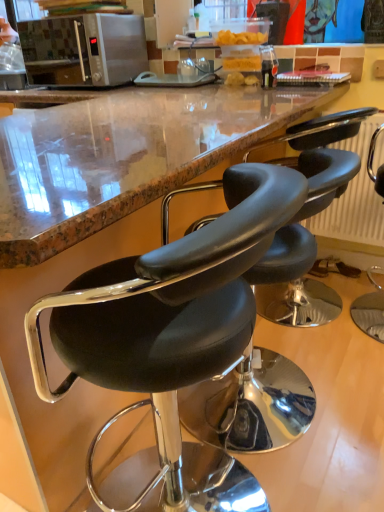
Question: Would you consider black leather chair at right, which appears as the first chair when viewed from the right, to be distant from black leather stool at center, arranged as the third chair when viewed from the right?

Choices:
 (A) no
 (B) yes

Answer: (B)

Question: Considering the relative sizes of black leather chair at right, the 3th chair in the left-to-right sequence, and black leather stool at center, positioned as the first chair in left-to-right order, in the image provided, is black leather chair at right, the 3th chair in the left-to-right sequence, smaller than black leather stool at center, positioned as the first chair in left-to-right order,?

Choices:
 (A) yes
 (B) no

Answer: (A)

Question: Can you confirm if black leather chair at right, which appears as the first chair when viewed from the right, is thinner than black leather stool at center, positioned as the first chair in left-to-right order?

Choices:
 (A) no
 (B) yes

Answer: (B)

Question: Considering the relative sizes of black leather chair at right, the 3th chair in the left-to-right sequence, and black leather stool at center, arranged as the third chair when viewed from the right, in the image provided, is black leather chair at right, the 3th chair in the left-to-right sequence, shorter than black leather stool at center, arranged as the third chair when viewed from the right,?

Choices:
 (A) yes
 (B) no

Answer: (A)

Question: From a real-world perspective, does black leather chair at right, the 3th chair in the left-to-right sequence, stand above black leather stool at center, arranged as the third chair when viewed from the right?

Choices:
 (A) no
 (B) yes

Answer: (A)

Question: Based on their positions, is black leather chair at right, which appears as the first chair when viewed from the right, located to the left or right of black leather stool at center, the 2th chair from the left?

Choices:
 (A) right
 (B) left

Answer: (A)

Question: Looking at the image, does black leather chair at right, the 3th chair in the left-to-right sequence, seem bigger or smaller compared to black leather stool at center, the 2th chair from the left?

Choices:
 (A) big
 (B) small

Answer: (B)

Question: From a real-world perspective, is black leather chair at right, which appears as the first chair when viewed from the right, physically located above or below black leather stool at center, the 2th chair from the left?

Choices:
 (A) above
 (B) below

Answer: (A)

Question: From the image's perspective, is black leather chair at right, which appears as the first chair when viewed from the right, above or below black leather stool at center, the 2th chair from the right?

Choices:
 (A) above
 (B) below

Answer: (A)

Question: Relative to black leather stool at center, arranged as the third chair when viewed from the right, is satin silver microwave at upper left in front or behind?

Choices:
 (A) front
 (B) behind

Answer: (B)

Question: Considering the positions of point (137, 60) and point (38, 320), is point (137, 60) closer or farther from the camera than point (38, 320)?

Choices:
 (A) farther
 (B) closer

Answer: (A)

Question: From a real-world perspective, relative to black leather stool at center, arranged as the third chair when viewed from the right, is satin silver microwave at upper left vertically above or below?

Choices:
 (A) above
 (B) below

Answer: (A)

Question: Looking at the image, does satin silver microwave at upper left seem bigger or smaller compared to black leather stool at center, positioned as the first chair in left-to-right order?

Choices:
 (A) big
 (B) small

Answer: (B)

Question: Is black leather stool at center, positioned as the first chair in left-to-right order, taller or shorter than satin silver microwave at upper left?

Choices:
 (A) tall
 (B) short

Answer: (A)

Question: In the image, is black leather stool at center, positioned as the first chair in left-to-right order, on the left side or the right side of satin silver microwave at upper left?

Choices:
 (A) right
 (B) left

Answer: (A)